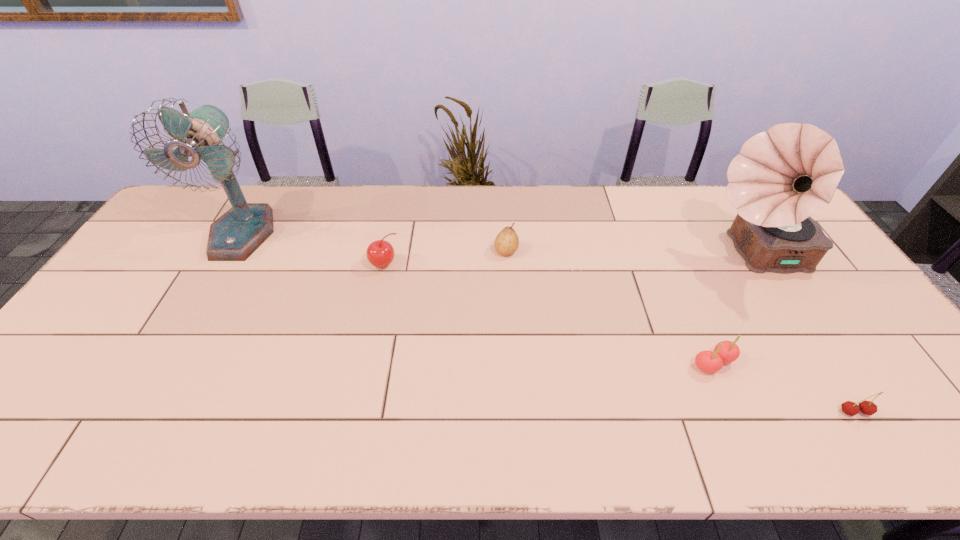
At what (x,y) coordinates should I click in order to perform the action: click on fan. Please return your answer as a coordinate pair (x, y). The width and height of the screenshot is (960, 540). Looking at the image, I should click on (234, 236).

Locate an element on the screen. The image size is (960, 540). record player is located at coordinates (781, 177).

Where is `the fourth object from right to left`? This screenshot has height=540, width=960. the fourth object from right to left is located at coordinates (506, 243).

The width and height of the screenshot is (960, 540). Identify the location of the second object from left to right. (380, 253).

Identify the location of the farthest cherry. (380, 253).

At what (x,y) coordinates should I click in order to perform the action: click on the second nearest cherry. Please return your answer as a coordinate pair (x, y). The image size is (960, 540). Looking at the image, I should click on (725, 351).

Find the location of a particular element. This screenshot has height=540, width=960. the second nearest object is located at coordinates (725, 351).

Image resolution: width=960 pixels, height=540 pixels. I want to click on the nearest cherry, so click(x=849, y=408).

This screenshot has width=960, height=540. Identify the location of the nearest object. (849, 408).

Where is `free region located 0.150m in front of the leftmost object where the wind blows`? free region located 0.150m in front of the leftmost object where the wind blows is located at coordinates (205, 298).